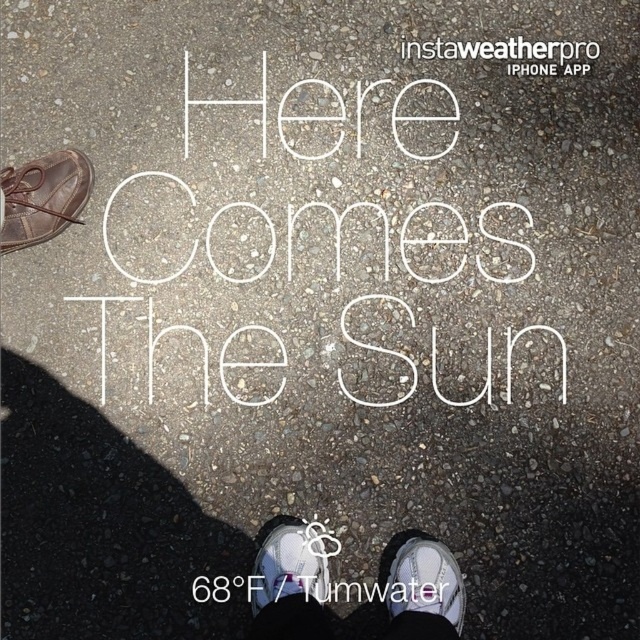
Question: Which of these objects is positioned closest to the brown leather shoe at upper left?

Choices:
 (A) white mesh shoe at lower center
 (B) white canvas shoe at lower center
 (C) white leather shoe at center

Answer: (C)

Question: Which object is closer to the camera taking this photo?

Choices:
 (A) white canvas shoe at lower center
 (B) brown leather shoe at upper left
 (C) white mesh shoe at lower center

Answer: (A)

Question: Can you confirm if white leather shoe at center is positioned to the right of white mesh shoe at lower center?

Choices:
 (A) yes
 (B) no

Answer: (B)

Question: Which of the following is the farthest from the observer?

Choices:
 (A) (412, 600)
 (B) (301, 540)
 (C) (3, 236)

Answer: (B)

Question: Can you confirm if brown leather shoe at upper left is positioned above white leather shoe at center?

Choices:
 (A) no
 (B) yes

Answer: (B)

Question: Can you confirm if brown leather shoe at upper left is positioned below white mesh shoe at lower center?

Choices:
 (A) no
 (B) yes

Answer: (A)